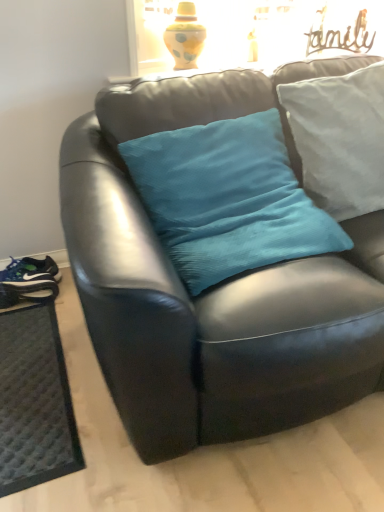
Find the location of a particular element. This screenshot has height=512, width=384. empty space that is ontop of dark gray textured mat at lower left (from a real-world perspective) is located at coordinates (37, 375).